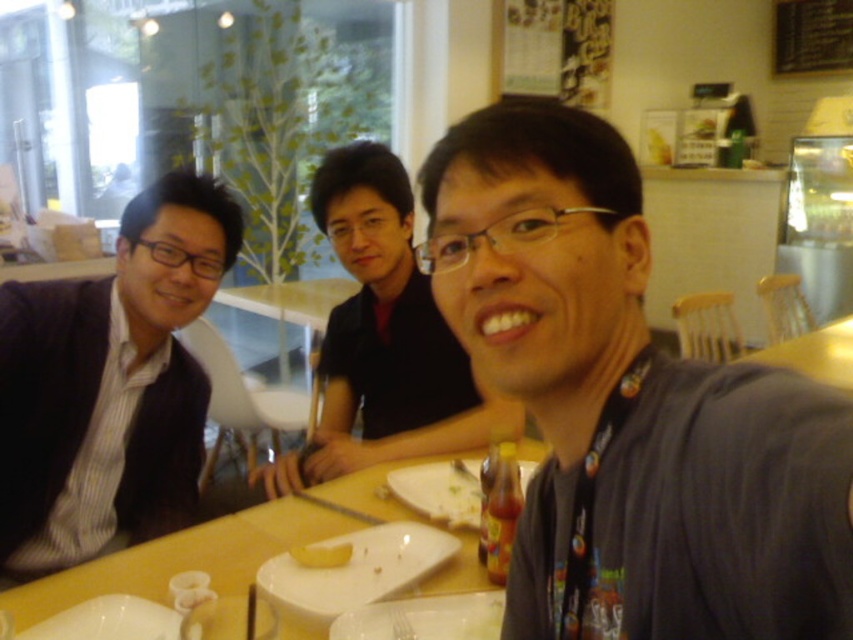
You are a photographer taking a picture of the dining scene. The matte black suit at left and the yellow matte bread at center are both in the frame. Based on their positions, which object is closer to the camera?

The matte black suit at left is located above the yellow matte bread at center, so it is closer to the camera.

You are a photographer trying to capture a group photo of the matte black suit at left and the wooden table at center. Considering their sizes, which object should you focus on first to ensure proper framing?

The matte black suit at left is larger in size compared to the wooden table at center, so you should focus on the matte black suit at left first to ensure proper framing.